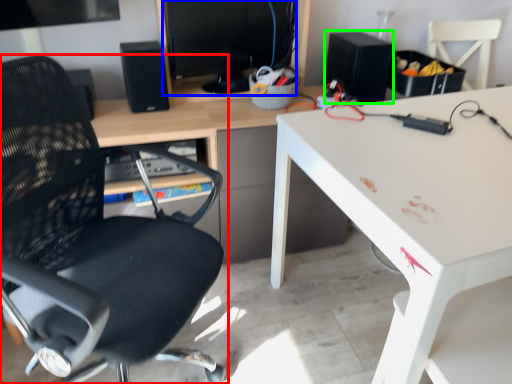
Question: Which is nearer to the chair (highlighted by a red box)? computer monitor (highlighted by a blue box) or speaker (highlighted by a green box).

Choices:
 (A) computer monitor
 (B) speaker

Answer: (A)